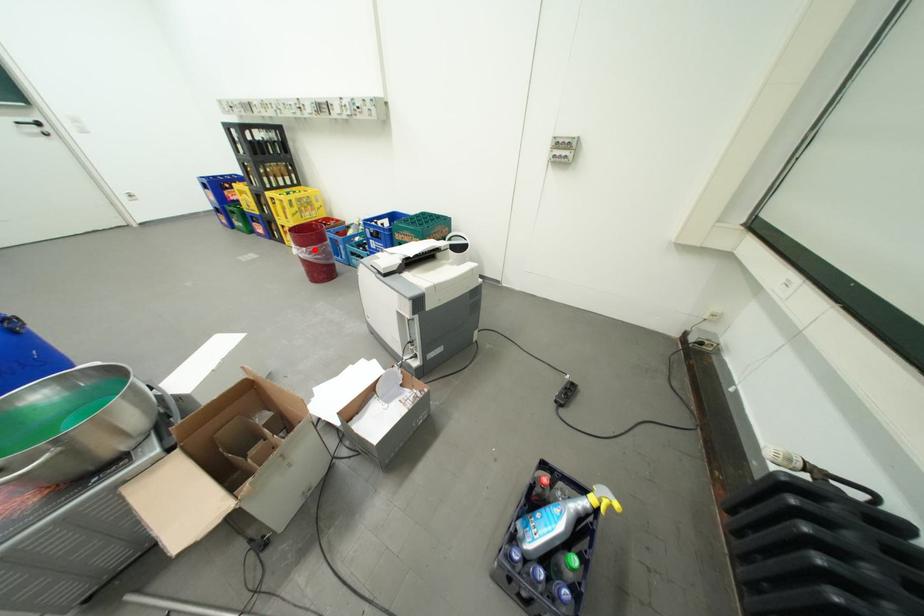
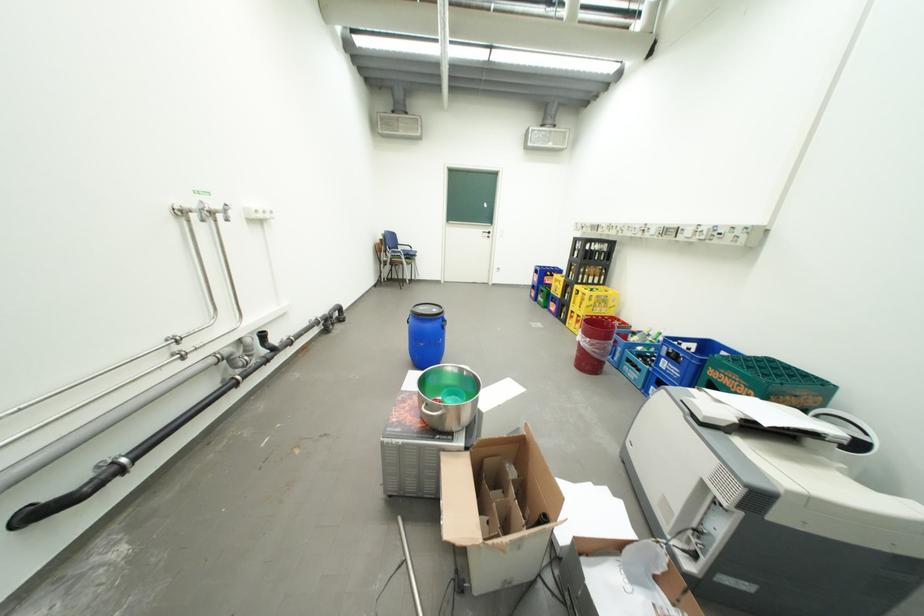
Where in the second image is the point corresponding to the highlighted location from the first image?

(599, 341)